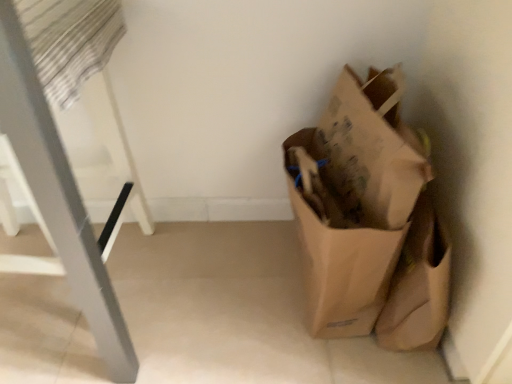
In order to face metallic silver ladder at left, should I rotate leftwards or rightwards?

Rotate your view left by about 29.364°.

What is the approximate height of metallic silver ladder at left?

metallic silver ladder at left is 28.34 inches in height.

This screenshot has width=512, height=384. What do you see at coordinates (58, 196) in the screenshot?
I see `metallic silver ladder at left` at bounding box center [58, 196].

Where is `metallic silver ladder at left`? The width and height of the screenshot is (512, 384). metallic silver ladder at left is located at coordinates (58, 196).

What is the approximate height of brown paper bag at right?

It is 53.28 centimeters.

The width and height of the screenshot is (512, 384). In order to click on brown paper bag at right in this screenshot , I will do `click(355, 200)`.

What do you see at coordinates (355, 200) in the screenshot?
I see `brown paper bag at right` at bounding box center [355, 200].

At what (x,y) coordinates should I click in order to perform the action: click on metallic silver ladder at left. Please return your answer as a coordinate pair (x, y). The height and width of the screenshot is (384, 512). Looking at the image, I should click on (58, 196).

Is metallic silver ladder at left at the left side of brown paper bag at right?

Correct, you'll find metallic silver ladder at left to the left of brown paper bag at right.

Consider the image. Is metallic silver ladder at left in front of or behind brown paper bag at right in the image?

Clearly, metallic silver ladder at left is in front of brown paper bag at right.

Which is closer to the camera, (x=102, y=270) or (x=416, y=196)?

Positioned in front is point (x=102, y=270).

From the image's perspective, which is below, metallic silver ladder at left or brown paper bag at right?

brown paper bag at right is shown below in the image.

From a real-world perspective, is metallic silver ladder at left physically above brown paper bag at right?

Yes, from a real-world perspective, metallic silver ladder at left is above brown paper bag at right.

Does metallic silver ladder at left have a greater width compared to brown paper bag at right?

Yes.

Does metallic silver ladder at left have a lesser height compared to brown paper bag at right?

No, metallic silver ladder at left is not shorter than brown paper bag at right.

Considering the sizes of objects metallic silver ladder at left and brown paper bag at right in the image provided, who is bigger, metallic silver ladder at left or brown paper bag at right?

metallic silver ladder at left.

Is brown paper bag at right inside metallic silver ladder at left?

Definitely not — brown paper bag at right is not inside metallic silver ladder at left.

Is metallic silver ladder at left far from brown paper bag at right?

metallic silver ladder at left is near brown paper bag at right, not far away.

Could you tell me if metallic silver ladder at left is facing brown paper bag at right?

Yes, metallic silver ladder at left is aimed at brown paper bag at right.

How different are the orientations of metallic silver ladder at left and brown paper bag at right in degrees?

89.5 degrees separate the facing orientations of metallic silver ladder at left and brown paper bag at right.

How far apart are metallic silver ladder at left and brown paper bag at right?

metallic silver ladder at left is 19.51 inches away from brown paper bag at right.

Locate an element on the screen. The width and height of the screenshot is (512, 384). furniture above the brown paper bag at right (from the image's perspective) is located at coordinates (58, 196).

Is brown paper bag at right to the right of metallic silver ladder at left from the viewer's perspective?

Correct, you'll find brown paper bag at right to the right of metallic silver ladder at left.

Which is behind, brown paper bag at right or metallic silver ladder at left?

brown paper bag at right is further from the camera.

Considering the points (387, 77) and (122, 360), which point is behind, point (387, 77) or point (122, 360)?

The point (387, 77) is more distant.

From the image's perspective, between brown paper bag at right and metallic silver ladder at left, who is located below?

From the image's view, brown paper bag at right is below.

From a real-world perspective, who is located lower, brown paper bag at right or metallic silver ladder at left?

In real-world perspective, brown paper bag at right is lower.

Between brown paper bag at right and metallic silver ladder at left, which one has smaller width?

Thinner between the two is brown paper bag at right.

Which of these two, brown paper bag at right or metallic silver ladder at left, stands shorter?

With less height is brown paper bag at right.

Between brown paper bag at right and metallic silver ladder at left, which one has smaller size?

brown paper bag at right is smaller.

Is brown paper bag at right inside the boundaries of metallic silver ladder at left, or outside?

brown paper bag at right lies outside metallic silver ladder at left.

Is brown paper bag at right far away from metallic silver ladder at left?

That's not correct — brown paper bag at right is a little close to metallic silver ladder at left.

Is brown paper bag at right oriented towards metallic silver ladder at left?

No.

Based on the photo, what's the angular difference between brown paper bag at right and metallic silver ladder at left's facing directions?

The angle between the facing direction of brown paper bag at right and the facing direction of metallic silver ladder at left is 89.5 degrees.

How much distance is there between brown paper bag at right and metallic silver ladder at left?

19.51 inches.

At what (x,y) coordinates should I click in order to perform the action: click on grocery bag on the right of metallic silver ladder at left. Please return your answer as a coordinate pair (x, y). Looking at the image, I should click on (355, 200).

In order to click on furniture above the brown paper bag at right (from the image's perspective) in this screenshot , I will do `click(58, 196)`.

What are the coordinates of `grocery bag directly beneath the metallic silver ladder at left (from a real-world perspective)` in the screenshot? It's located at [x=355, y=200].